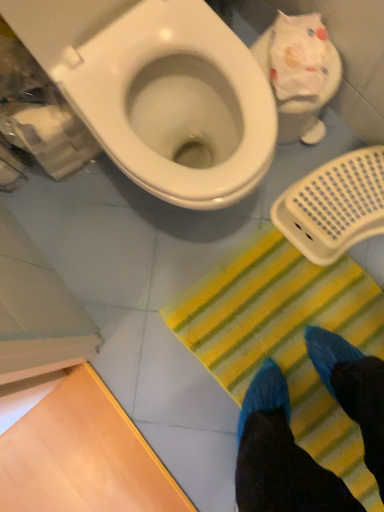
Question: Considering the relative sizes of white glossy toilet at upper left, the 2th toilet from the right, and yellow striped mat at lower center in the image provided, is white glossy toilet at upper left, the 2th toilet from the right, wider than yellow striped mat at lower center?

Choices:
 (A) no
 (B) yes

Answer: (A)

Question: Can you confirm if white glossy toilet at upper left, the 2th toilet from the right, is positioned to the left of yellow striped mat at lower center?

Choices:
 (A) no
 (B) yes

Answer: (B)

Question: Does white glossy toilet at upper left, the first toilet viewed from the left, appear on the right side of yellow striped mat at lower center?

Choices:
 (A) no
 (B) yes

Answer: (A)

Question: Could yellow striped mat at lower center be considered to be inside white glossy toilet at upper left, the first toilet viewed from the left?

Choices:
 (A) no
 (B) yes

Answer: (A)

Question: Considering the relative sizes of white glossy toilet at upper left, the first toilet viewed from the left, and yellow striped mat at lower center in the image provided, is white glossy toilet at upper left, the first toilet viewed from the left, smaller than yellow striped mat at lower center?

Choices:
 (A) yes
 (B) no

Answer: (B)

Question: In terms of size, does white glossy toilet at upper left, the first toilet viewed from the left, appear bigger or smaller than yellow striped mat at lower center?

Choices:
 (A) small
 (B) big

Answer: (B)

Question: Choose the correct answer: Is white glossy toilet at upper left, the 2th toilet from the right, inside yellow striped mat at lower center or outside it?

Choices:
 (A) inside
 (B) outside

Answer: (B)

Question: In terms of height, does white glossy toilet at upper left, the 2th toilet from the right, look taller or shorter compared to yellow striped mat at lower center?

Choices:
 (A) short
 (B) tall

Answer: (B)

Question: In the image, is white glossy toilet at upper left, the first toilet viewed from the left, positioned in front of or behind yellow striped mat at lower center?

Choices:
 (A) behind
 (B) front

Answer: (B)

Question: From the image's perspective, relative to white glossy toilet at upper left, the first toilet viewed from the left, is white plastic toilet at upper right, positioned as the first toilet in right-to-left order, above or below?

Choices:
 (A) above
 (B) below

Answer: (A)

Question: Based on their sizes in the image, would you say white plastic toilet at upper right, which is counted as the second toilet, starting from the left, is bigger or smaller than white glossy toilet at upper left, the 2th toilet from the right?

Choices:
 (A) small
 (B) big

Answer: (A)

Question: Considering the positions of white plastic toilet at upper right, positioned as the first toilet in right-to-left order, and white glossy toilet at upper left, the 2th toilet from the right, in the image, is white plastic toilet at upper right, positioned as the first toilet in right-to-left order, wider or thinner than white glossy toilet at upper left, the 2th toilet from the right,?

Choices:
 (A) thin
 (B) wide

Answer: (A)

Question: Is white plastic toilet at upper right, which is counted as the second toilet, starting from the left, in front of or behind white glossy toilet at upper left, the first toilet viewed from the left, in the image?

Choices:
 (A) front
 (B) behind

Answer: (B)

Question: Visually, is white glossy toilet at upper left, the first toilet viewed from the left, positioned to the left or to the right of white plastic toilet at upper right, which is counted as the second toilet, starting from the left?

Choices:
 (A) left
 (B) right

Answer: (A)

Question: Is point (119, 157) closer or farther from the camera than point (276, 56)?

Choices:
 (A) closer
 (B) farther

Answer: (A)